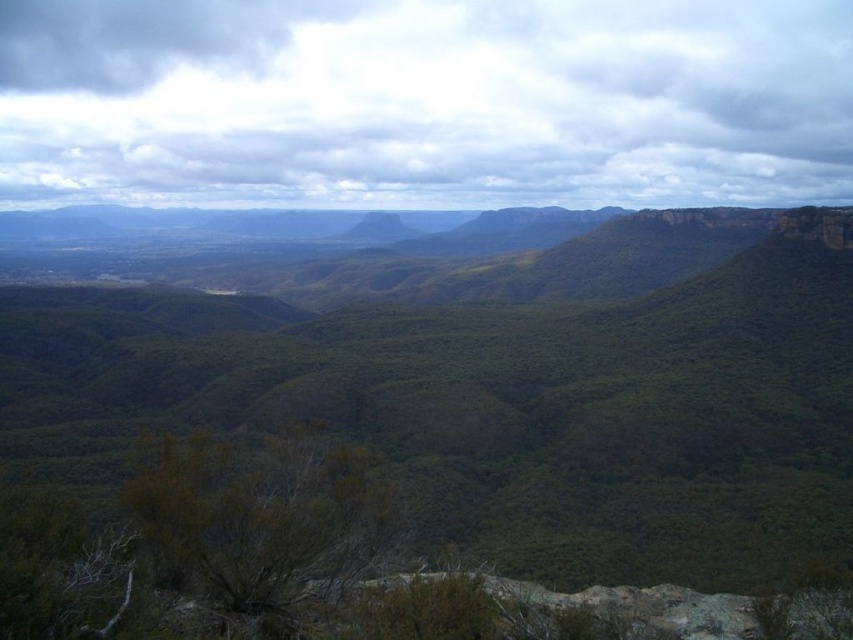
You are standing at the overlook point in the foreground of the rugged mountain landscape. You want to take a photo of the cloudy sky at upper center. According to the coordinates provided, where should you point your camera?

You should point your camera to the coordinates point at (424, 102) to capture the cloudy sky at upper center.

Consider the image. You are standing at the overlook point on the rocky outcrop in the foreground. You see the cloudy sky at upper center and the green grassy peak at center. Which object is closer to you?

The cloudy sky at upper center is closer to you because it is further to the viewer than the green grassy peak at center.